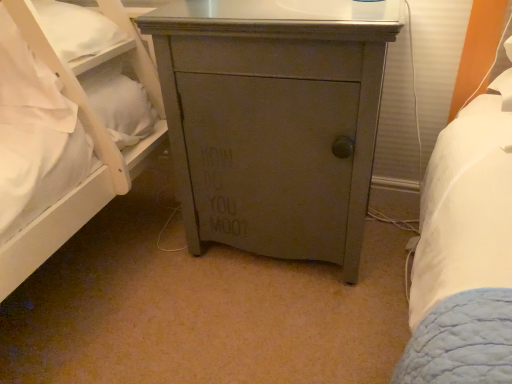
Question: From the image's perspective, would you say matte gray cabinet at center is positioned over white soft pillow at left?

Choices:
 (A) yes
 (B) no

Answer: (B)

Question: Considering the relative positions of matte gray cabinet at center and white soft pillow at left in the image provided, is matte gray cabinet at center to the right of white soft pillow at left from the viewer's perspective?

Choices:
 (A) no
 (B) yes

Answer: (B)

Question: Does matte gray cabinet at center appear on the left side of white soft pillow at left?

Choices:
 (A) no
 (B) yes

Answer: (A)

Question: Is matte gray cabinet at center positioned in front of white soft pillow at left?

Choices:
 (A) yes
 (B) no

Answer: (A)

Question: Can you confirm if matte gray cabinet at center is smaller than white soft pillow at left?

Choices:
 (A) yes
 (B) no

Answer: (B)

Question: Is white soft pillow at left inside matte gray cabinet at center?

Choices:
 (A) yes
 (B) no

Answer: (B)

Question: Is white soft pillow at left to the right of matte gray cabinet at center from the viewer's perspective?

Choices:
 (A) yes
 (B) no

Answer: (B)

Question: Is white soft pillow at left far away from matte gray cabinet at center?

Choices:
 (A) yes
 (B) no

Answer: (B)

Question: Is the depth of white soft pillow at left greater than that of matte gray cabinet at center?

Choices:
 (A) yes
 (B) no

Answer: (A)

Question: Does white soft pillow at left have a larger size compared to matte gray cabinet at center?

Choices:
 (A) no
 (B) yes

Answer: (A)

Question: Is white soft pillow at left positioned with its back to matte gray cabinet at center?

Choices:
 (A) yes
 (B) no

Answer: (B)

Question: From a real-world perspective, is white soft pillow at left over matte gray cabinet at center?

Choices:
 (A) no
 (B) yes

Answer: (B)

Question: From the image's perspective, is white soft pillow at left positioned above or below matte gray cabinet at center?

Choices:
 (A) below
 (B) above

Answer: (B)